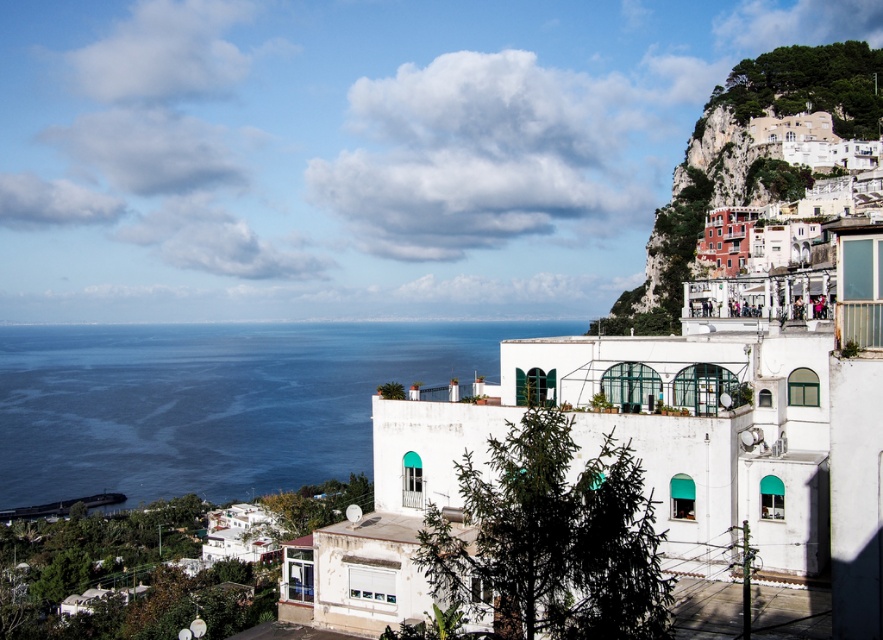
You are a photographer planning to capture the white stucco houses at upper right and the blue water at left in a single shot. Based on their positions, which object would appear closer to the left edge of your photo?

The blue water at left would appear closer to the left edge of the photo since it is positioned to the left of the white stucco houses at upper right.